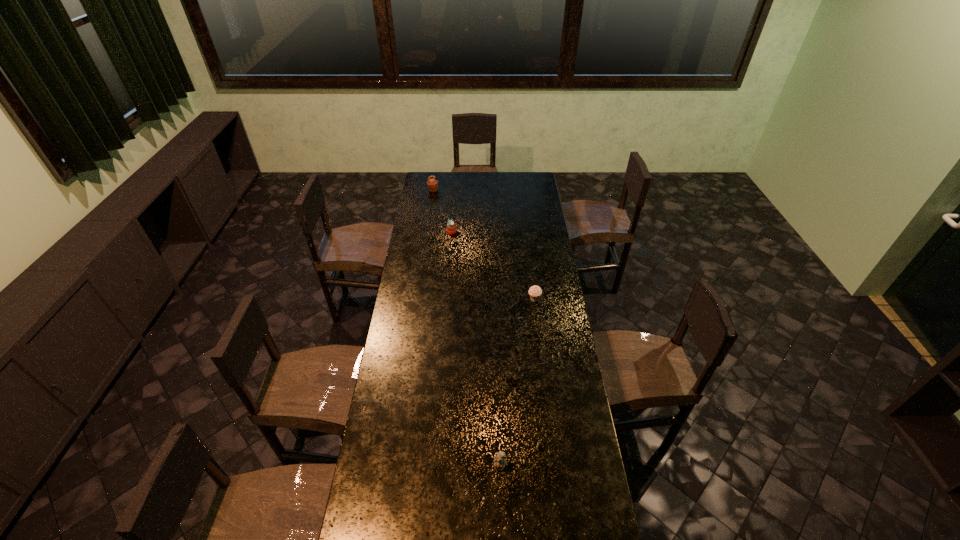
What are the coordinates of `free space located on the back of the nearest muffin` in the screenshot? It's located at (532, 280).

Identify the location of free space located on the front-facing side of the nearest object. tap(501, 500).

This screenshot has width=960, height=540. Identify the location of object that is at the far edge. (432, 184).

The height and width of the screenshot is (540, 960). I want to click on object situated at the left edge, so click(x=432, y=184).

Locate an element on the screen. object that is positioned at the right edge is located at coordinates (535, 292).

Locate an element on the screen. This screenshot has height=540, width=960. object at the far left corner is located at coordinates (432, 184).

Find the location of a particular element. The height and width of the screenshot is (540, 960). vacant space at the far edge is located at coordinates (461, 185).

What are the coordinates of `vacant area at the left edge of the desktop` in the screenshot? It's located at (421, 309).

Locate an element on the screen. The image size is (960, 540). free space at the right edge of the desktop is located at coordinates (550, 231).

Find the location of a particular element. free spot between the rightmost object and the leftmost muffin is located at coordinates (484, 245).